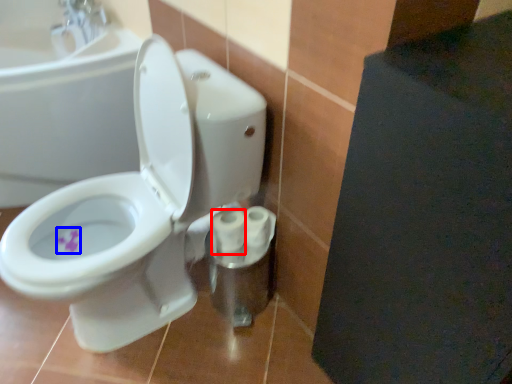
Question: Which of the following is the closest to the observer, toilet paper (highlighted by a red box) or flower (highlighted by a blue box)?

Choices:
 (A) toilet paper
 (B) flower

Answer: (A)